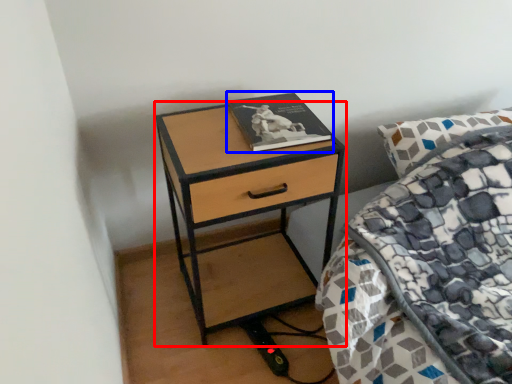
Question: Which object appears closest to the camera in this image, nightstand (highlighted by a red box) or book (highlighted by a blue box)?

Choices:
 (A) nightstand
 (B) book

Answer: (A)